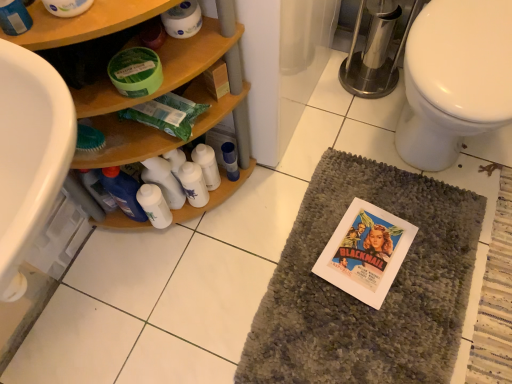
Find the location of a particular element. The height and width of the screenshot is (384, 512). free spot to the right of blue glossy bottle at center, the second bottle from the left is located at coordinates (283, 179).